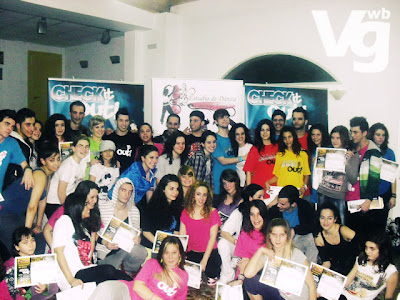
Find the location of `hood`. hood is located at coordinates (125, 181).